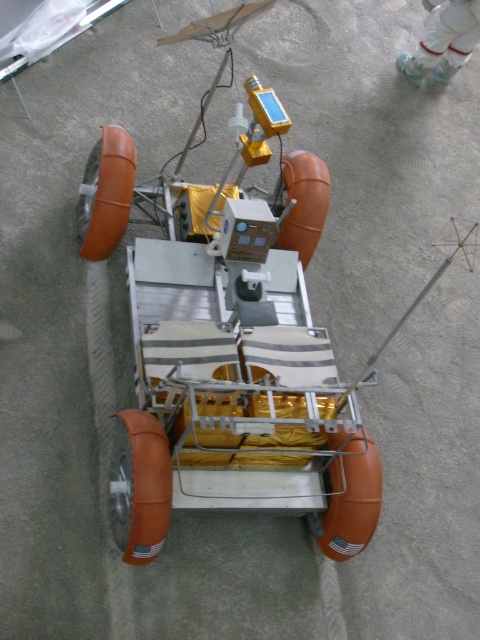
You are an astronaut preparing for a simulated mission. You see the metallic silver rover at center and the white fabric suit at upper center. Which object is closer to you?

The metallic silver rover at center is closer to you because it is positioned in front of the white fabric suit at upper center.

You are standing in a room with a metallic silver rover at center. If you want to take a photo of the rover from a distance of exactly 10 feet, will you need to move closer or farther away from the rover?

The metallic silver rover at center is currently 9.74 feet away from the camera. To achieve a distance of exactly 10 feet, you would need to move slightly farther away from the rover.